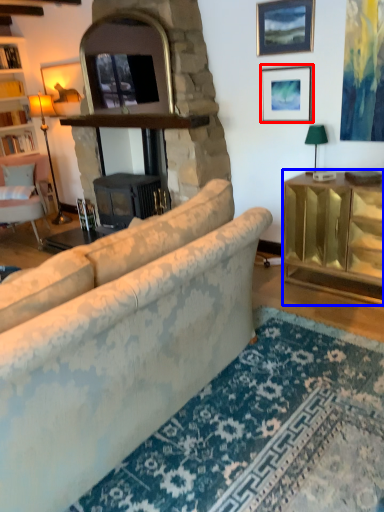
Question: Which object is further to the camera taking this photo, picture frame (highlighted by a red box) or cabinetry (highlighted by a blue box)?

Choices:
 (A) picture frame
 (B) cabinetry

Answer: (A)